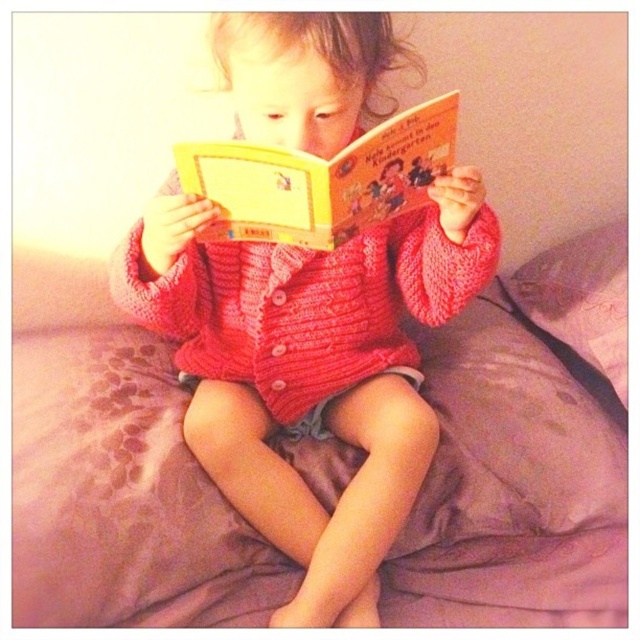
You are taking a photo of the child and the book. You want to focus on the point closer to the camera. Which point should you choose between point (93, 353) and point (531, 289)?

Point (93, 353) is closer to the camera than point (531, 289), so you should choose point (93, 353) to focus on.

You are standing in the room where the child is reading. You want to place a small nightlight on the bed such that it is exactly 3 feet away from the point marked as point (294, 291). Is this possible given the bed dimensions?

The distance between point (294, 291) and the viewer is 37.70 inches. Since 3 feet equals 36 inches, placing the nightlight 36 inches away from point (294, 291) is feasible as it is slightly shorter than the existing distance.

You are a parent trying to place a small nightlight between the pink fabric bed at center and the purple soft pillow at upper right. The nightlight requires 7 inches of space to be placed safely. Can you fit it between them?

The pink fabric bed at center and purple soft pillow at upper right are 6.98 inches apart, which is less than the required 7 inches. Therefore, the nightlight cannot be safely placed between them.